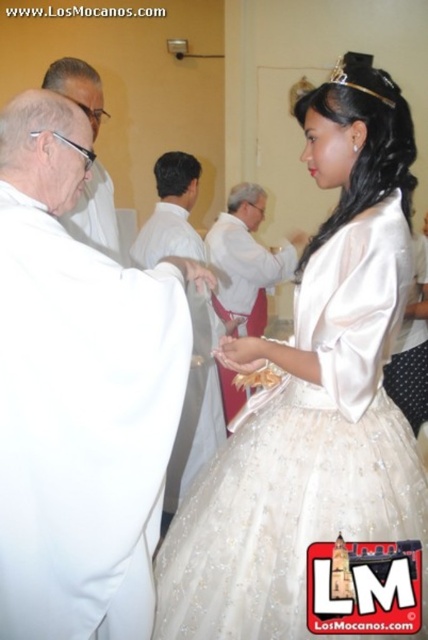
You are a photographer at the event and need to ensure both the ivory satin dress at center and the white satin robe at center are visible in the photo. Based on their positions, which one will appear closer to the camera?

The ivory satin dress at center is in front of the white satin robe at center, so it will appear closer to the camera.

You are a photographer at a formal event. You need to capture a photo of both the ivory satin dress at center and the white satin robe at center. According to the scene description, which one is on the right side when facing the image?

The ivory satin dress at center is positioned on the right side of the white satin robe at center, so when facing the image, the ivory satin dress at center is on the right.

You are a photographer at the event and need to decide which robe to use for a closeup shot. The camera can only focus on objects larger than a certain size. If the matte white robe at left is too small for the camera to focus, will the white satin robe at center be suitable?

The white satin robe at center is bigger than the matte white robe at left. Since the matte white robe at left is too small for the camera to focus, the white satin robe at center should be suitable as it is larger and meets the minimum size requirement.